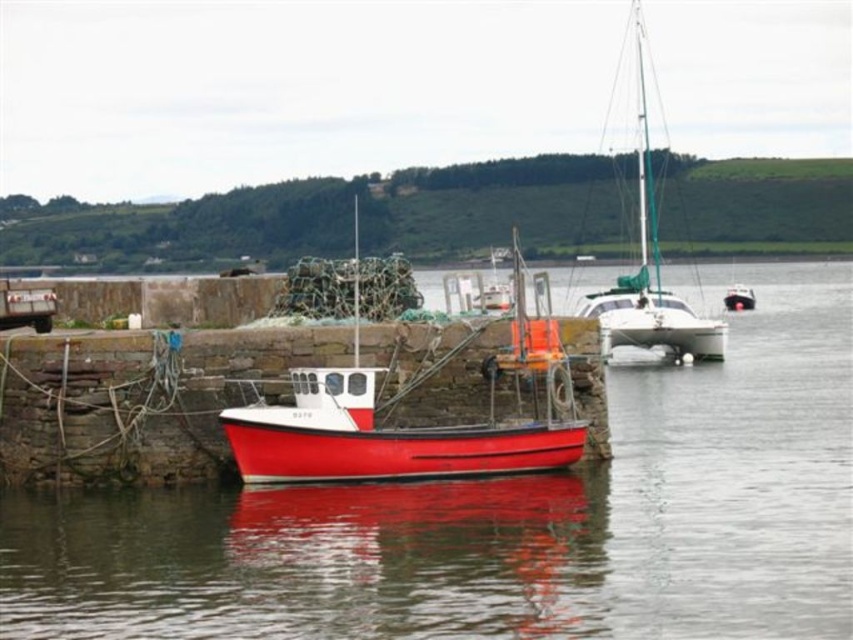
You are standing on the pier and want to board the red matte boat at center. Considering the pier is 100 feet long, can you reach the boat without walking the entire length of the pier?

The red matte boat at center is 101.18 feet away from the viewer. Since the pier is only 100 feet long, you would need to walk the entire length of the pier and still be 1.18 feet short of reaching the boat.